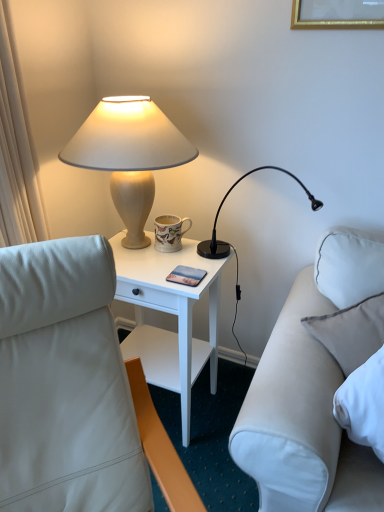
Image resolution: width=384 pixels, height=512 pixels. I want to click on free point below matte beige lamp at upper left, the 2th lamp in the right-to-left sequence (from a real-world perspective), so click(137, 252).